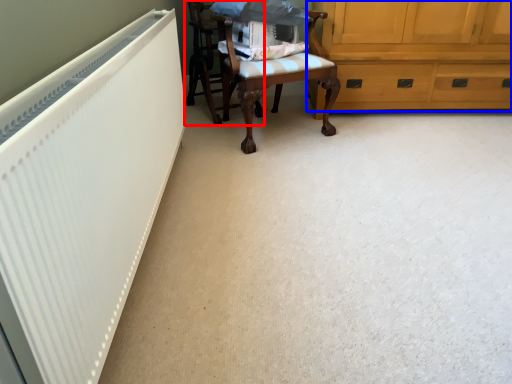
Question: Which object appears farthest to the camera in this image, chair (highlighted by a red box) or cabinetry (highlighted by a blue box)?

Choices:
 (A) chair
 (B) cabinetry

Answer: (B)